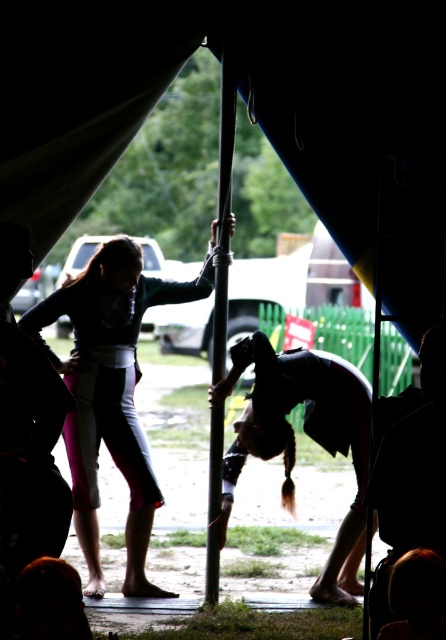
This screenshot has height=640, width=446. What are the coordinates of `light pink fabric pants at center` in the screenshot? It's located at (110, 394).

Is light pink fabric pants at center below dark brown hair at center?

Actually, light pink fabric pants at center is above dark brown hair at center.

Is point (129, 477) positioned before point (280, 404)?

No, it is not.

The width and height of the screenshot is (446, 640). What are the coordinates of `light pink fabric pants at center` in the screenshot? It's located at (110, 394).

Can you confirm if dark brown hair at center is wider than metallic pole at center?

Correct, the width of dark brown hair at center exceeds that of metallic pole at center.

The height and width of the screenshot is (640, 446). Describe the element at coordinates (294, 442) in the screenshot. I see `dark brown hair at center` at that location.

Locate an element on the screen. The height and width of the screenshot is (640, 446). dark brown hair at center is located at coordinates (294, 442).

Consider the image. Is light pink fabric pants at center further to the viewer compared to metallic pole at center?

Yes, it is behind metallic pole at center.

Does point (136, 324) lie behind point (223, 100)?

Yes, it is.

Which is in front, point (94, 435) or point (234, 93)?

Point (234, 93) is more forward.

You are a GUI agent. You are given a task and a screenshot of the screen. Output one action in this format:
    pyautogui.click(x=<x>, y=<y>)
    Task: Click on the light pink fabric pants at center
    Image resolution: width=446 pixels, height=640 pixels.
    Given the screenshot: What is the action you would take?
    pyautogui.click(x=110, y=394)